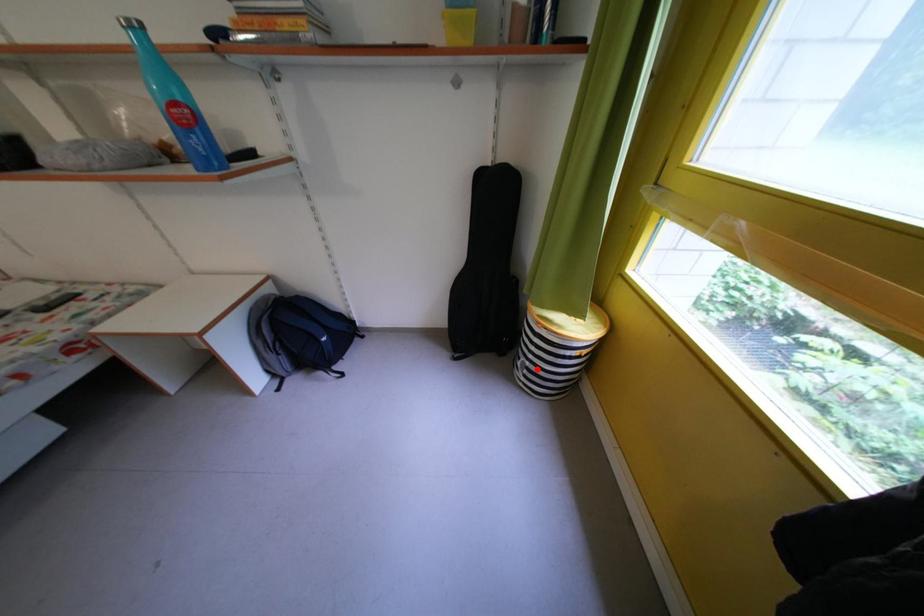
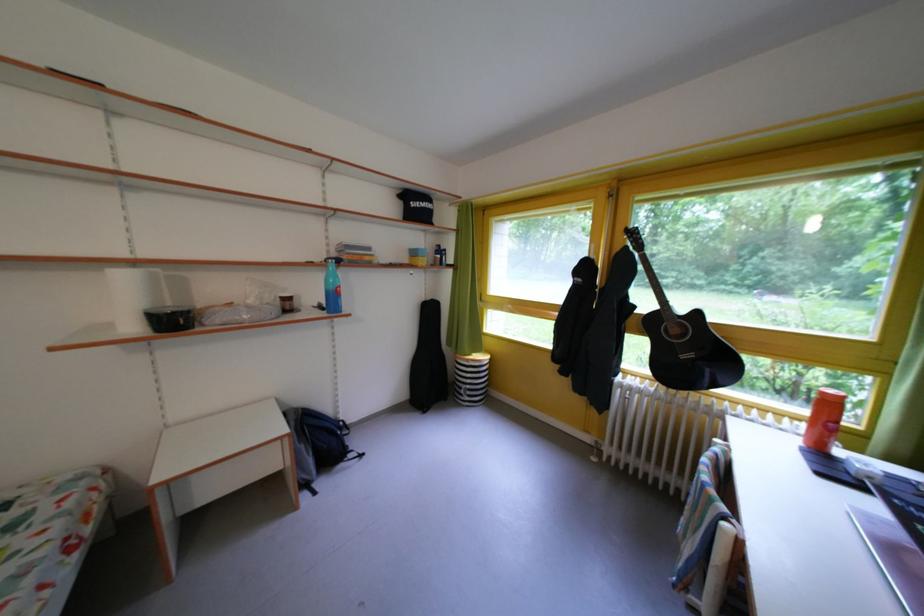
In the second image, find the point that corresponds to the highlighted location in the first image.

(478, 392)